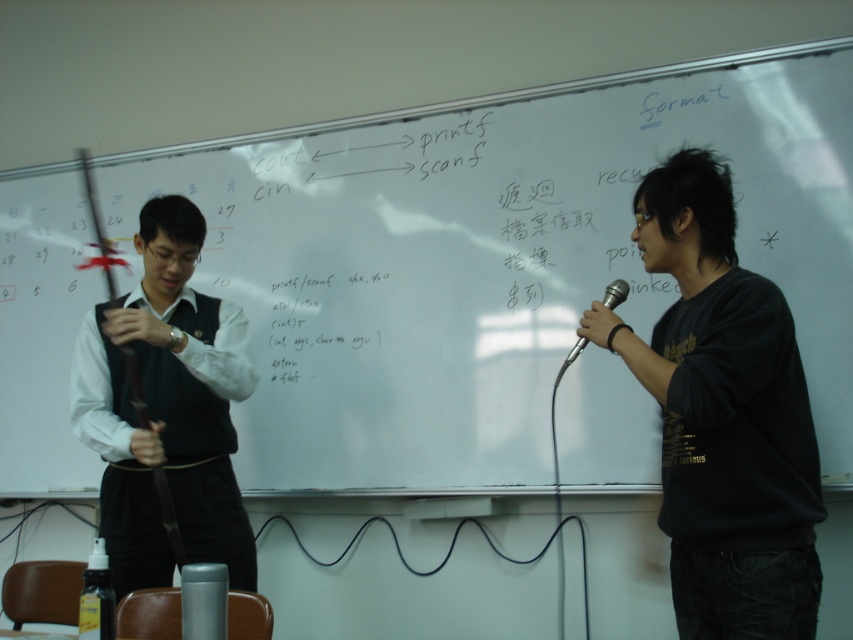
You are a photographer standing in the back of the classroom. You want to take a photo that includes both the black matte vest at left and the silver metallic microphone at right without any part of them being cut off. What is the minimum distance you need to step back from the current position to ensure both objects are fully visible in the frame?

The black matte vest at left and the silver metallic microphone at right are 3.40 feet apart. To ensure both are fully visible, you need to step back at least 3.40 feet from your current position.

You are a student sitting in the classroom. You see two points on the whiteboard. The first point is at coordinate point (39, 170) and the second is at coordinate point (138, 458). Which point is closer to you?

The point at coordinate point (39, 170) is closer to you because it is further to the viewer than point (138, 458).